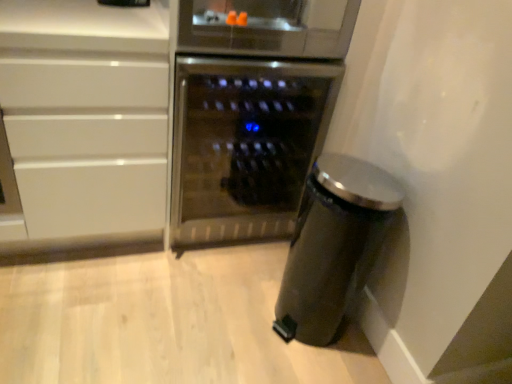
The image size is (512, 384). In order to click on satin black trash can at lower right in this screenshot , I will do `click(333, 246)`.

Between stainless steel wine cooler at center and white glossy cabinet at left, which one has more height?

With more height is white glossy cabinet at left.

Is stainless steel wine cooler at center further to camera compared to white glossy cabinet at left?

Yes, stainless steel wine cooler at center is behind white glossy cabinet at left.

Is stainless steel wine cooler at center in contact with white glossy cabinet at left?

stainless steel wine cooler at center and white glossy cabinet at left are not in contact.

Who is bigger, stainless steel wine cooler at center or white glossy cabinet at left?

white glossy cabinet at left is bigger.

From the image's perspective, relative to satin black trash can at lower right, is stainless steel wine cooler at center above or below?

Based on their image positions, stainless steel wine cooler at center is located above satin black trash can at lower right.

Between stainless steel wine cooler at center and satin black trash can at lower right, which one is positioned behind?

Positioned behind is stainless steel wine cooler at center.

Can you confirm if stainless steel wine cooler at center is bigger than satin black trash can at lower right?

Yes, stainless steel wine cooler at center is bigger than satin black trash can at lower right.

Is stainless steel wine cooler at center at the back of satin black trash can at lower right?

Correct, satin black trash can at lower right is looking away from stainless steel wine cooler at center.

From the image's perspective, between satin black trash can at lower right and stainless steel wine cooler at center, who is located below?

satin black trash can at lower right.

Is satin black trash can at lower right taller or shorter than stainless steel wine cooler at center?

satin black trash can at lower right is shorter than stainless steel wine cooler at center.

Considering the positions of objects satin black trash can at lower right and stainless steel wine cooler at center in the image provided, who is more to the left, satin black trash can at lower right or stainless steel wine cooler at center?

stainless steel wine cooler at center.

Based on the photo, is satin black trash can at lower right further to camera compared to white glossy cabinet at left?

That is True.

Which of these two, satin black trash can at lower right or white glossy cabinet at left, is smaller?

satin black trash can at lower right is smaller.

From a real-world perspective, is satin black trash can at lower right above or below white glossy cabinet at left?

From a real-world perspective, satin black trash can at lower right is physically below white glossy cabinet at left.

Between satin black trash can at lower right and white glossy cabinet at left, which one has more height?

white glossy cabinet at left is taller.

From a real-world perspective, between white glossy cabinet at left and stainless steel wine cooler at center, who is vertically lower?

stainless steel wine cooler at center, from a real-world perspective.

Is white glossy cabinet at left facing away from stainless steel wine cooler at center?

That's not correct — white glossy cabinet at left is not looking away from stainless steel wine cooler at center.

Is white glossy cabinet at left positioned beyond the bounds of stainless steel wine cooler at center?

Indeed, white glossy cabinet at left is completely outside stainless steel wine cooler at center.

Find the location of `cabinetry in front of the stainless steel wine cooler at center`. cabinetry in front of the stainless steel wine cooler at center is located at coordinates (84, 120).

Is white glossy cabinet at left facing towards satin black trash can at lower right?

No, white glossy cabinet at left is not facing towards satin black trash can at lower right.

Does point (93, 235) come closer to viewer compared to point (358, 166)?

No.

Is white glossy cabinet at left thinner than satin black trash can at lower right?

In fact, white glossy cabinet at left might be wider than satin black trash can at lower right.

Is white glossy cabinet at left not inside satin black trash can at lower right?

Yes, white glossy cabinet at left is located beyond the bounds of satin black trash can at lower right.

Find the location of a particular element. home appliance behind the white glossy cabinet at left is located at coordinates (251, 112).

The width and height of the screenshot is (512, 384). What are the coordinates of `kitchen appliance below the stainless steel wine cooler at center (from the image's perspective)` in the screenshot? It's located at (333, 246).

Based on the photo, considering their positions, is stainless steel wine cooler at center positioned further to white glossy cabinet at left than satin black trash can at lower right?

satin black trash can at lower right.

Looking at this image, based on their spatial positions, is white glossy cabinet at left or stainless steel wine cooler at center further from satin black trash can at lower right?

white glossy cabinet at left lies further to satin black trash can at lower right than the other object.

Based on the photo, based on their spatial positions, is satin black trash can at lower right or stainless steel wine cooler at center closer to white glossy cabinet at left?

Among the two, stainless steel wine cooler at center is located nearer to white glossy cabinet at left.

When comparing their distances from stainless steel wine cooler at center, does white glossy cabinet at left or satin black trash can at lower right seem further?

satin black trash can at lower right lies further to stainless steel wine cooler at center than the other object.

Based on their spatial positions, is stainless steel wine cooler at center or white glossy cabinet at left closer to satin black trash can at lower right?

stainless steel wine cooler at center is positioned closer to the anchor satin black trash can at lower right.

Considering their positions, is satin black trash can at lower right positioned closer to stainless steel wine cooler at center than white glossy cabinet at left?

white glossy cabinet at left is closer to stainless steel wine cooler at center.

Image resolution: width=512 pixels, height=384 pixels. I want to click on home appliance located between white glossy cabinet at left and satin black trash can at lower right in the left-right direction, so click(x=251, y=112).